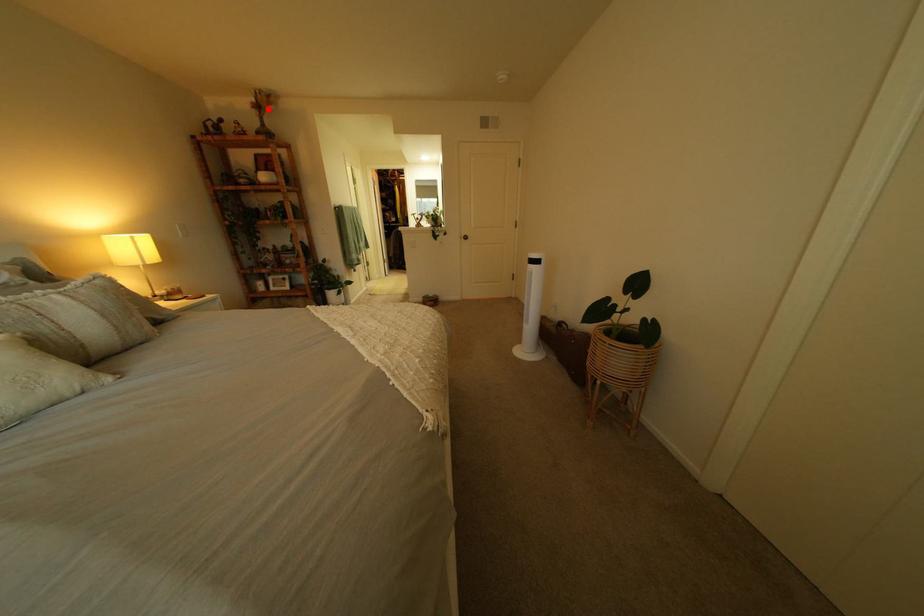
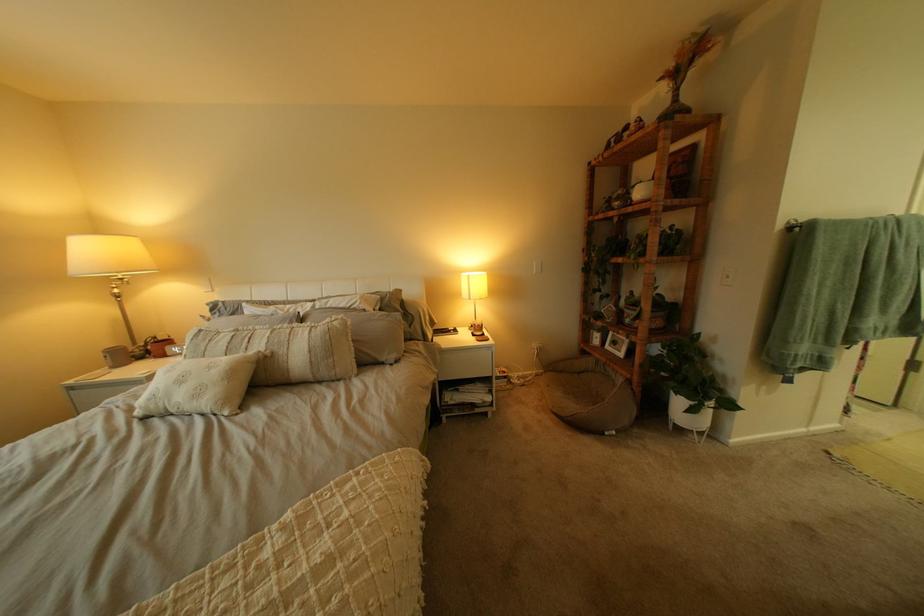
Locate, in the second image, the point that corresponds to the highlighted location in the first image.

(675, 81)